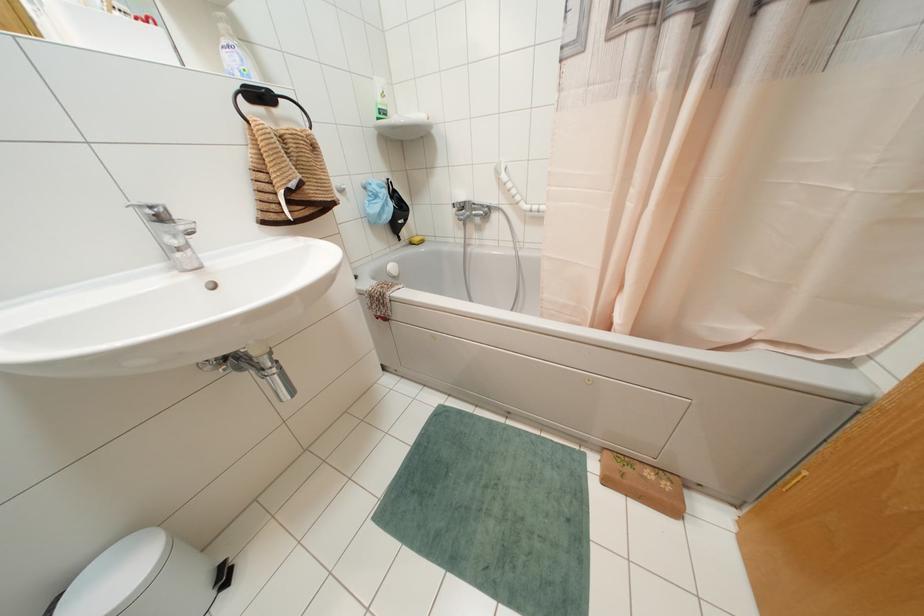
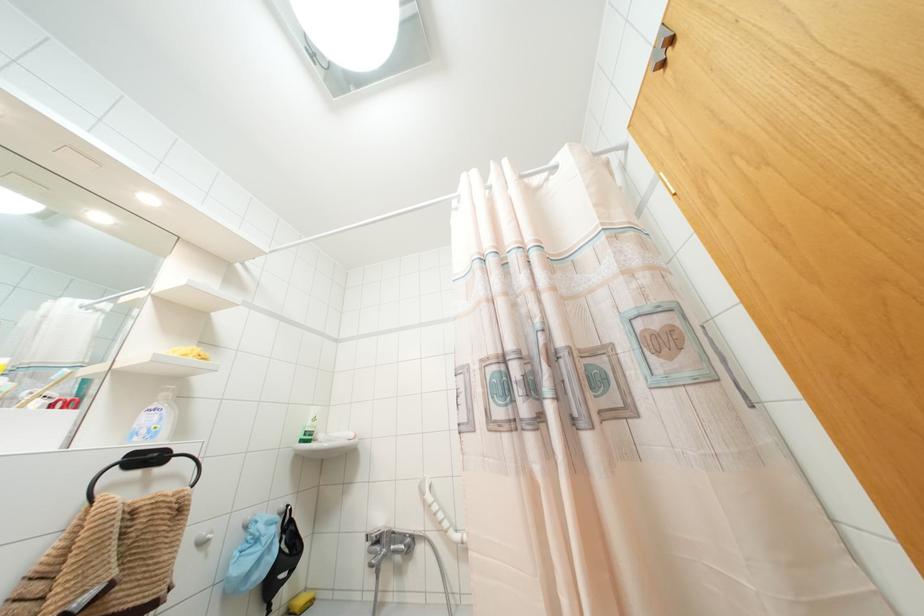
Where in the second image is the point corresponding to [416,238] from the first image?

(299, 601)